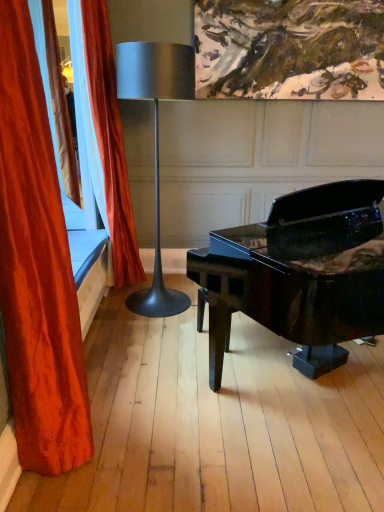
Question: Would you consider velvet red curtain at left, the 1th curtain positioned from the front, to be distant from metallic silver lamp at center?

Choices:
 (A) yes
 (B) no

Answer: (A)

Question: Does velvet red curtain at left, the 1th curtain positioned from the front, have a smaller size compared to metallic silver lamp at center?

Choices:
 (A) no
 (B) yes

Answer: (B)

Question: Does velvet red curtain at left, the 1th curtain positioned from the front, have a lesser height compared to metallic silver lamp at center?

Choices:
 (A) yes
 (B) no

Answer: (B)

Question: From a real-world perspective, is velvet red curtain at left, the 1th curtain positioned from the front, located higher than metallic silver lamp at center?

Choices:
 (A) yes
 (B) no

Answer: (A)

Question: Would you say velvet red curtain at left, the 1th curtain positioned from the front, contains metallic silver lamp at center?

Choices:
 (A) yes
 (B) no

Answer: (B)

Question: Looking at their shapes, would you say velvet red curtain at left, the 1th curtain positioned from the front, is wider or thinner than glossy black piano at center?

Choices:
 (A) wide
 (B) thin

Answer: (B)

Question: From a real-world perspective, is velvet red curtain at left, the 2th curtain viewed from the back, above or below glossy black piano at center?

Choices:
 (A) above
 (B) below

Answer: (A)

Question: Is velvet red curtain at left, the 1th curtain positioned from the front, inside or outside of glossy black piano at center?

Choices:
 (A) outside
 (B) inside

Answer: (A)

Question: Considering the positions of velvet red curtain at left, the 1th curtain positioned from the front, and glossy black piano at center in the image, is velvet red curtain at left, the 1th curtain positioned from the front, taller or shorter than glossy black piano at center?

Choices:
 (A) tall
 (B) short

Answer: (A)

Question: Considering the positions of glossy black piano at center and metallic silver lamp at center in the image, is glossy black piano at center wider or thinner than metallic silver lamp at center?

Choices:
 (A) thin
 (B) wide

Answer: (B)

Question: From their relative heights in the image, would you say glossy black piano at center is taller or shorter than metallic silver lamp at center?

Choices:
 (A) short
 (B) tall

Answer: (A)

Question: From the image's perspective, is glossy black piano at center above or below metallic silver lamp at center?

Choices:
 (A) above
 (B) below

Answer: (B)

Question: In the image, is glossy black piano at center positioned in front of or behind metallic silver lamp at center?

Choices:
 (A) front
 (B) behind

Answer: (A)

Question: Is point (324, 208) closer or farther from the camera than point (89, 4)?

Choices:
 (A) closer
 (B) farther

Answer: (A)

Question: Considering their positions, is glossy black piano at center located in front of or behind velvet orange curtain at left, marked as the 2th curtain in a front-to-back arrangement?

Choices:
 (A) behind
 (B) front

Answer: (B)